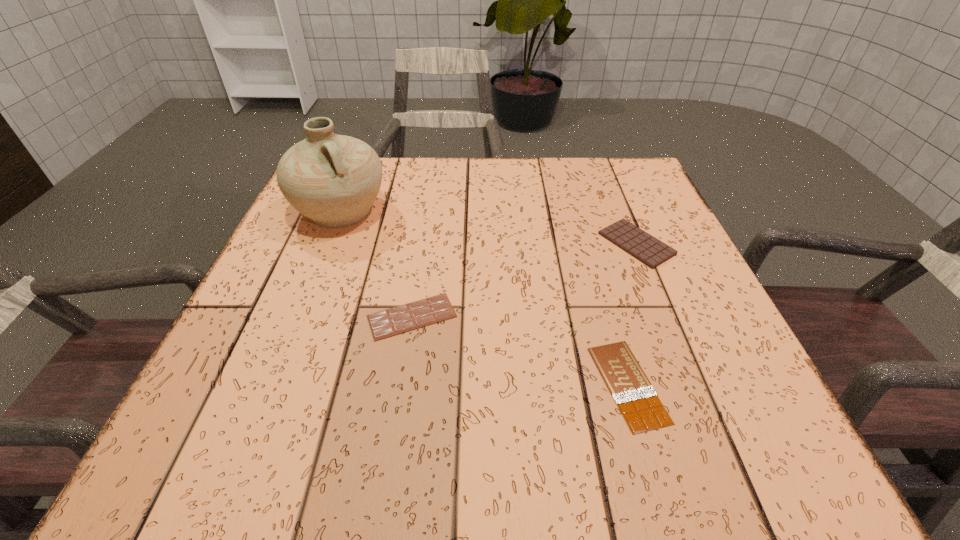
Identify the location of vacant space that is in between the third farthest object and the third shortest object. The height and width of the screenshot is (540, 960). (524, 280).

I want to click on free space between the pottery and the tallest chocolate bar, so click(x=489, y=227).

You are a GUI agent. You are given a task and a screenshot of the screen. Output one action in this format:
    pyautogui.click(x=<x>, y=<y>)
    Task: Click on the object that is the second closest to the nearest object
    The height and width of the screenshot is (540, 960).
    Given the screenshot: What is the action you would take?
    pyautogui.click(x=390, y=322)

Identify the location of object that stands as the closest to the third farthest object. (332, 179).

Select which chocolate bar is the second closest to the second nearest object. Please provide its 2D coordinates. Your answer should be formatted as a tuple, i.e. [(x, y)], where the tuple contains the x and y coordinates of a point satisfying the conditions above.

[(649, 250)]

This screenshot has height=540, width=960. What are the coordinates of `the second closest chocolate bar to the second object from left to right` in the screenshot? It's located at (649, 250).

The width and height of the screenshot is (960, 540). I want to click on free region that satisfies the following two spatial constraints: 1. on the back side of the second nearest chocolate bar; 2. on the right side of the tallest chocolate bar, so click(x=423, y=244).

Where is `free space that satisfies the following two spatial constraints: 1. on the front side of the tallest chocolate bar; 2. on the left side of the tallest object`? free space that satisfies the following two spatial constraints: 1. on the front side of the tallest chocolate bar; 2. on the left side of the tallest object is located at coordinates 327,244.

Where is `free point that satisfies the following two spatial constraints: 1. on the back side of the shortest object; 2. on the right side of the farthest chocolate bar`? free point that satisfies the following two spatial constraints: 1. on the back side of the shortest object; 2. on the right side of the farthest chocolate bar is located at coordinates (588, 244).